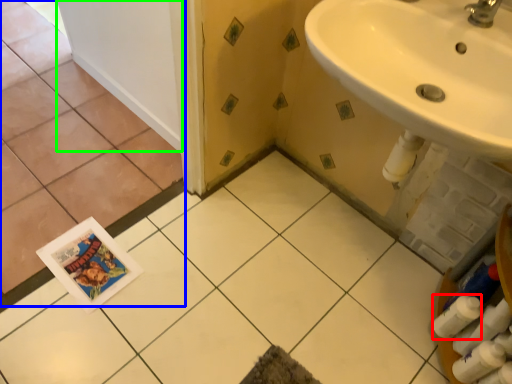
Question: Which object is positioned closest to toilet paper (highlighted by a red box)? Select from ceramic tile (highlighted by a blue box) and door (highlighted by a green box).

Choices:
 (A) ceramic tile
 (B) door

Answer: (A)